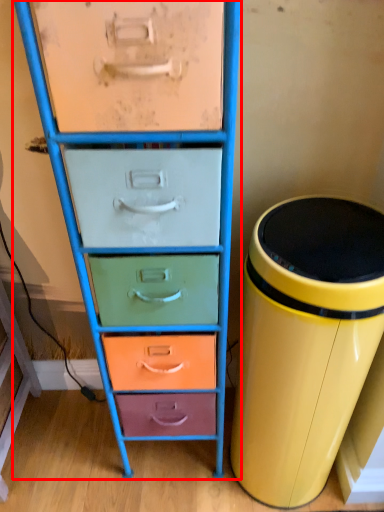
Question: From the image's perspective, what is the correct spatial positioning of chest of drawers (annotated by the red box) in reference to waste container?

Choices:
 (A) below
 (B) above

Answer: (B)